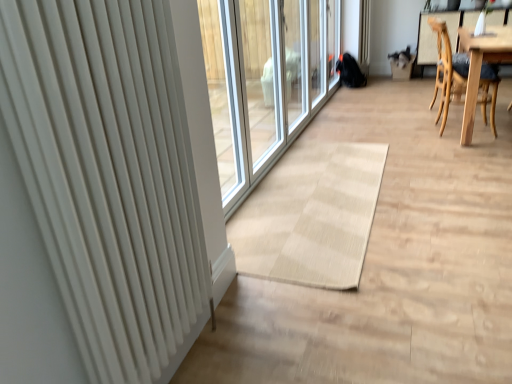
Identify the location of light brown wooden chair at right. (448, 72).

The image size is (512, 384). What do you see at coordinates (448, 72) in the screenshot? I see `light brown wooden chair at right` at bounding box center [448, 72].

The width and height of the screenshot is (512, 384). What do you see at coordinates (109, 176) in the screenshot? I see `white matte radiator at left` at bounding box center [109, 176].

The image size is (512, 384). What are the coordinates of `white matte radiator at left` in the screenshot? It's located at (109, 176).

Where is `light brown wooden chair at right`? This screenshot has width=512, height=384. light brown wooden chair at right is located at coordinates (448, 72).

Which object is positioned more to the left, light brown wooden chair at right or white matte radiator at left?

white matte radiator at left.

Considering the positions of objects light brown wooden chair at right and white matte radiator at left in the image provided, who is behind, light brown wooden chair at right or white matte radiator at left?

Positioned behind is light brown wooden chair at right.

Does point (488, 63) come behind point (102, 84)?

Yes, it is.

From the image's perspective, is light brown wooden chair at right located above white matte radiator at left?

Indeed, from the image's perspective, light brown wooden chair at right is shown above white matte radiator at left.

From a real-world perspective, is light brown wooden chair at right located beneath white matte radiator at left?

Yes, from a real-world perspective, light brown wooden chair at right is beneath white matte radiator at left.

In the scene shown: Between light brown wooden chair at right and white matte radiator at left, which one has larger width?

With larger width is light brown wooden chair at right.

Which of these two, light brown wooden chair at right or white matte radiator at left, stands taller?

white matte radiator at left is taller.

Considering the sizes of light brown wooden chair at right and white matte radiator at left in the image, is light brown wooden chair at right bigger or smaller than white matte radiator at left?

Clearly, light brown wooden chair at right is larger in size than white matte radiator at left.

Is light brown wooden chair at right outside of white matte radiator at left?

Yes, light brown wooden chair at right is not within white matte radiator at left.

Is light brown wooden chair at right not near white matte radiator at left?

Yes, light brown wooden chair at right and white matte radiator at left are located far from each other.

Could you tell me if light brown wooden chair at right is facing white matte radiator at left?

No.

Can you tell me how much light brown wooden chair at right and white matte radiator at left differ in facing direction?

The facing directions of light brown wooden chair at right and white matte radiator at left are 2.02 degrees apart.

This screenshot has height=384, width=512. What are the coordinates of `chair located underneath the white matte radiator at left (from a real-world perspective)` in the screenshot? It's located at (448, 72).

Can you confirm if white matte radiator at left is positioned to the left of light brown wooden chair at right?

Correct, you'll find white matte radiator at left to the left of light brown wooden chair at right.

Which object is further away from the camera, white matte radiator at left or light brown wooden chair at right?

light brown wooden chair at right is further from the camera.

Is point (92, 209) farther from viewer compared to point (461, 80)?

No, (92, 209) is closer to viewer.

From the image's perspective, is white matte radiator at left located above light brown wooden chair at right?

No, from the image's perspective, white matte radiator at left is not on top of light brown wooden chair at right.

From a real-world perspective, is white matte radiator at left above or below light brown wooden chair at right?

Clearly, from a real-world perspective, white matte radiator at left is above light brown wooden chair at right.

Considering the sizes of white matte radiator at left and light brown wooden chair at right in the image, is white matte radiator at left wider or thinner than light brown wooden chair at right?

Considering their sizes, white matte radiator at left looks slimmer than light brown wooden chair at right.

Consider the image. Can you confirm if white matte radiator at left is taller than light brown wooden chair at right?

Yes.

Can you confirm if white matte radiator at left is smaller than light brown wooden chair at right?

Yes, white matte radiator at left is smaller than light brown wooden chair at right.

Is white matte radiator at left located outside light brown wooden chair at right?

That's correct, white matte radiator at left is outside of light brown wooden chair at right.

Is white matte radiator at left not near light brown wooden chair at right?

Yes, white matte radiator at left and light brown wooden chair at right are quite far apart.

Could you tell me if white matte radiator at left is turned towards light brown wooden chair at right?

No, white matte radiator at left is not oriented towards light brown wooden chair at right.

How distant is white matte radiator at left from light brown wooden chair at right?

white matte radiator at left and light brown wooden chair at right are 9.78 feet apart.

The width and height of the screenshot is (512, 384). What are the coordinates of `chair that is under the white matte radiator at left (from a real-world perspective)` in the screenshot? It's located at (448, 72).

The width and height of the screenshot is (512, 384). Find the location of `radiator below the light brown wooden chair at right (from the image's perspective)`. radiator below the light brown wooden chair at right (from the image's perspective) is located at coordinates (109, 176).

Locate an element on the screen. chair on the right side of white matte radiator at left is located at coordinates (448, 72).